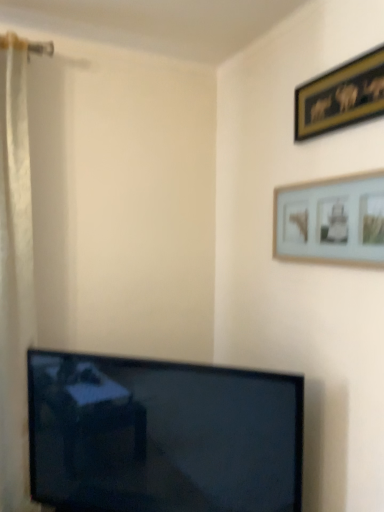
Describe the element at coordinates (331, 220) in the screenshot. This screenshot has width=384, height=512. I see `white matte picture frame at upper right, the 1th picture frame ordered from the bottom` at that location.

At what (x,y) coordinates should I click in order to perform the action: click on white matte picture frame at upper right, the 1th picture frame ordered from the bottom. Please return your answer as a coordinate pair (x, y). The width and height of the screenshot is (384, 512). Looking at the image, I should click on (331, 220).

What is the approximate width of white matte picture frame at upper right, the 1th picture frame ordered from the bottom?

white matte picture frame at upper right, the 1th picture frame ordered from the bottom, is 2.14 inches in width.

Describe the element at coordinates (341, 96) in the screenshot. This screenshot has width=384, height=512. I see `gold-framed picture at upper right, the 2th picture frame when ordered from bottom to top` at that location.

Find the location of `gold-framed picture at upper right, the 1th picture frame viewed from the top`. gold-framed picture at upper right, the 1th picture frame viewed from the top is located at coordinates coord(341,96).

The height and width of the screenshot is (512, 384). I want to click on white matte picture frame at upper right, which is counted as the second picture frame, starting from the top, so tap(331, 220).

Based on the photo, is gold-framed picture at upper right, the 2th picture frame when ordered from bottom to top, at the right side of white matte picture frame at upper right, the 1th picture frame ordered from the bottom?

Indeed, gold-framed picture at upper right, the 2th picture frame when ordered from bottom to top, is positioned on the right side of white matte picture frame at upper right, the 1th picture frame ordered from the bottom.

Relative to white matte picture frame at upper right, the 1th picture frame ordered from the bottom, is gold-framed picture at upper right, the 2th picture frame when ordered from bottom to top, in front or behind?

Visually, gold-framed picture at upper right, the 2th picture frame when ordered from bottom to top, is located behind white matte picture frame at upper right, the 1th picture frame ordered from the bottom.

Between point (328, 99) and point (341, 209), which one is positioned in front?

Point (341, 209)

From the image's perspective, is gold-framed picture at upper right, the 1th picture frame viewed from the top, above or below white matte picture frame at upper right, which is counted as the second picture frame, starting from the top?

Based on their image positions, gold-framed picture at upper right, the 1th picture frame viewed from the top, is located above white matte picture frame at upper right, which is counted as the second picture frame, starting from the top.

From a real-world perspective, which object rests below the other?

white matte picture frame at upper right, the 1th picture frame ordered from the bottom, from a real-world perspective.

In the scene shown: Is gold-framed picture at upper right, the 1th picture frame viewed from the top, thinner than white matte picture frame at upper right, the 1th picture frame ordered from the bottom?

Correct, the width of gold-framed picture at upper right, the 1th picture frame viewed from the top, is less than that of white matte picture frame at upper right, the 1th picture frame ordered from the bottom.

Does gold-framed picture at upper right, the 2th picture frame when ordered from bottom to top, have a lesser height compared to white matte picture frame at upper right, which is counted as the second picture frame, starting from the top?

Correct, gold-framed picture at upper right, the 2th picture frame when ordered from bottom to top, is not as tall as white matte picture frame at upper right, which is counted as the second picture frame, starting from the top.

Who is smaller, gold-framed picture at upper right, the 1th picture frame viewed from the top, or white matte picture frame at upper right, the 1th picture frame ordered from the bottom?

With smaller size is gold-framed picture at upper right, the 1th picture frame viewed from the top.

Is gold-framed picture at upper right, the 2th picture frame when ordered from bottom to top, not within white matte picture frame at upper right, which is counted as the second picture frame, starting from the top?

Indeed, gold-framed picture at upper right, the 2th picture frame when ordered from bottom to top, is completely outside white matte picture frame at upper right, which is counted as the second picture frame, starting from the top.

Are gold-framed picture at upper right, the 2th picture frame when ordered from bottom to top, and white matte picture frame at upper right, the 1th picture frame ordered from the bottom, located far from each other?

gold-framed picture at upper right, the 2th picture frame when ordered from bottom to top, is near white matte picture frame at upper right, the 1th picture frame ordered from the bottom, not far away.

Is gold-framed picture at upper right, the 2th picture frame when ordered from bottom to top, facing away from white matte picture frame at upper right, which is counted as the second picture frame, starting from the top?

gold-framed picture at upper right, the 2th picture frame when ordered from bottom to top, does not have its back to white matte picture frame at upper right, which is counted as the second picture frame, starting from the top.

How different are the orientations of gold-framed picture at upper right, the 2th picture frame when ordered from bottom to top, and white matte picture frame at upper right, the 1th picture frame ordered from the bottom, in degrees?

The angle between the facing direction of gold-framed picture at upper right, the 2th picture frame when ordered from bottom to top, and the facing direction of white matte picture frame at upper right, the 1th picture frame ordered from the bottom, is 0.000401 degrees.

This screenshot has width=384, height=512. In the image, there is a white matte picture frame at upper right, the 1th picture frame ordered from the bottom. In order to click on picture frame above it (from the image's perspective) in this screenshot , I will do `click(341, 96)`.

Based on the photo, considering the positions of objects white matte picture frame at upper right, which is counted as the second picture frame, starting from the top, and gold-framed picture at upper right, the 1th picture frame viewed from the top, in the image provided, who is more to the right, white matte picture frame at upper right, which is counted as the second picture frame, starting from the top, or gold-framed picture at upper right, the 1th picture frame viewed from the top,?

gold-framed picture at upper right, the 1th picture frame viewed from the top, is more to the right.

Is white matte picture frame at upper right, the 1th picture frame ordered from the bottom, in front of gold-framed picture at upper right, the 2th picture frame when ordered from bottom to top?

Yes, it is.

Which is closer, (x=313, y=202) or (x=374, y=87)?

Point (x=313, y=202) is farther from the camera than point (x=374, y=87).

From the image's perspective, does white matte picture frame at upper right, which is counted as the second picture frame, starting from the top, appear lower than gold-framed picture at upper right, the 1th picture frame viewed from the top?

Indeed, from the image's perspective, white matte picture frame at upper right, which is counted as the second picture frame, starting from the top, is shown beneath gold-framed picture at upper right, the 1th picture frame viewed from the top.

Looking at this image, from a real-world perspective, which object stands above the other?

gold-framed picture at upper right, the 2th picture frame when ordered from bottom to top, from a real-world perspective.

Is white matte picture frame at upper right, the 1th picture frame ordered from the bottom, thinner than gold-framed picture at upper right, the 2th picture frame when ordered from bottom to top?

No.

Does white matte picture frame at upper right, the 1th picture frame ordered from the bottom, have a lesser height compared to gold-framed picture at upper right, the 1th picture frame viewed from the top?

No.

Considering the sizes of objects white matte picture frame at upper right, which is counted as the second picture frame, starting from the top, and gold-framed picture at upper right, the 1th picture frame viewed from the top, in the image provided, who is smaller, white matte picture frame at upper right, which is counted as the second picture frame, starting from the top, or gold-framed picture at upper right, the 1th picture frame viewed from the top,?

gold-framed picture at upper right, the 1th picture frame viewed from the top, is smaller.

Is white matte picture frame at upper right, the 1th picture frame ordered from the bottom, outside of gold-framed picture at upper right, the 1th picture frame viewed from the top?

That's correct, white matte picture frame at upper right, the 1th picture frame ordered from the bottom, is outside of gold-framed picture at upper right, the 1th picture frame viewed from the top.

Is white matte picture frame at upper right, which is counted as the second picture frame, starting from the top, directly adjacent to gold-framed picture at upper right, the 1th picture frame viewed from the top?

No, white matte picture frame at upper right, which is counted as the second picture frame, starting from the top, is not beside gold-framed picture at upper right, the 1th picture frame viewed from the top.

Is white matte picture frame at upper right, which is counted as the second picture frame, starting from the top, facing away from gold-framed picture at upper right, the 2th picture frame when ordered from bottom to top?

No, gold-framed picture at upper right, the 2th picture frame when ordered from bottom to top, is not at the back of white matte picture frame at upper right, which is counted as the second picture frame, starting from the top.

Looking at this image, how far apart are white matte picture frame at upper right, the 1th picture frame ordered from the bottom, and gold-framed picture at upper right, the 2th picture frame when ordered from bottom to top?

white matte picture frame at upper right, the 1th picture frame ordered from the bottom, is 32.16 centimeters away from gold-framed picture at upper right, the 2th picture frame when ordered from bottom to top.

At what (x,y) coordinates should I click in order to perform the action: click on picture frame on the left of gold-framed picture at upper right, the 2th picture frame when ordered from bottom to top. Please return your answer as a coordinate pair (x, y). Looking at the image, I should click on (331, 220).

Image resolution: width=384 pixels, height=512 pixels. Find the location of `picture frame below the gold-framed picture at upper right, the 1th picture frame viewed from the top (from a real-world perspective)`. picture frame below the gold-framed picture at upper right, the 1th picture frame viewed from the top (from a real-world perspective) is located at coordinates (331, 220).

This screenshot has width=384, height=512. Find the location of `picture frame lying above the white matte picture frame at upper right, the 1th picture frame ordered from the bottom (from the image's perspective)`. picture frame lying above the white matte picture frame at upper right, the 1th picture frame ordered from the bottom (from the image's perspective) is located at coordinates tap(341, 96).